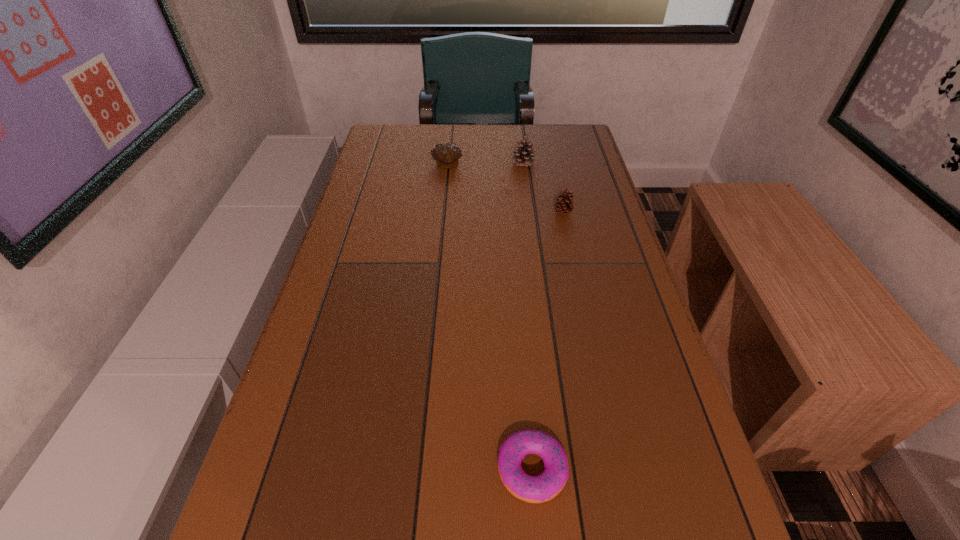
Find the location of `unoccupied area between the left pinecone and the leftmost object`. unoccupied area between the left pinecone and the leftmost object is located at coordinates (485, 164).

At what (x,y) coordinates should I click in order to perform the action: click on free space that is in between the shortest object and the muffin. Please return your answer as a coordinate pair (x, y). Looking at the image, I should click on (490, 318).

Identify the location of free space between the left pinecone and the rightmost object. pyautogui.click(x=543, y=188).

This screenshot has height=540, width=960. In order to click on vacant space that's between the leftmost object and the right pinecone in this screenshot , I will do `click(505, 190)`.

At what (x,y) coordinates should I click in order to perform the action: click on free point between the nearest object and the left pinecone. Please return your answer as a coordinate pair (x, y). Looking at the image, I should click on (528, 316).

Locate an element on the screen. Image resolution: width=960 pixels, height=540 pixels. free space between the leftmost object and the shortest object is located at coordinates (490, 318).

I want to click on vacant space in between the rightmost object and the doughnut, so click(x=547, y=341).

Find the location of a particular element. blank region between the leftmost object and the left pinecone is located at coordinates (485, 164).

Where is `object that is the third closest to the nearer pinecone`? This screenshot has height=540, width=960. object that is the third closest to the nearer pinecone is located at coordinates (533, 489).

Where is `the third closest object to the nearest object`? the third closest object to the nearest object is located at coordinates (525, 156).